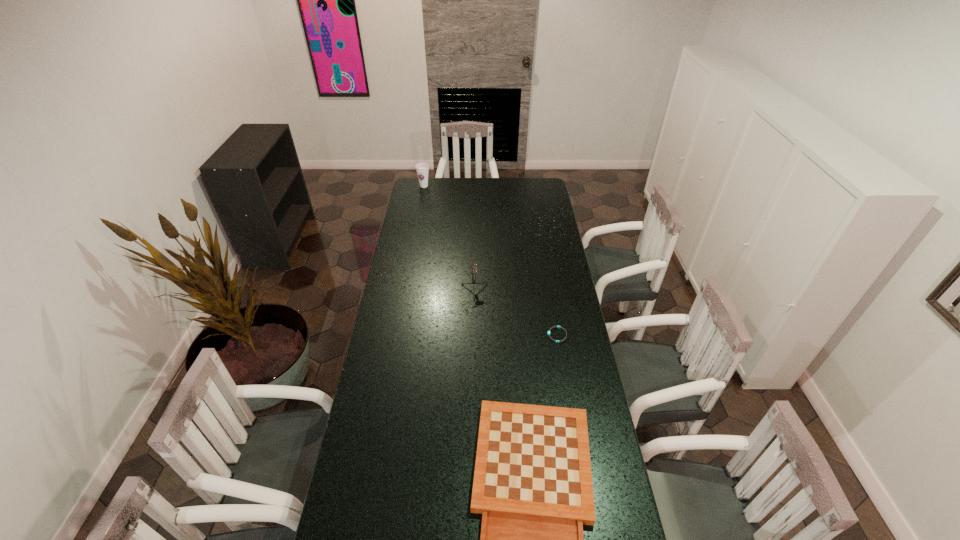
Locate an element on the screen. The image size is (960, 540). empty space between the second farthest object and the shortest object is located at coordinates (515, 317).

The width and height of the screenshot is (960, 540). In order to click on vacant area that lies between the second farthest object and the leftmost object in this screenshot , I will do `click(448, 242)`.

Image resolution: width=960 pixels, height=540 pixels. In order to click on free space between the farthest object and the third nearest object in this screenshot , I will do `click(448, 242)`.

Where is `free area in between the wristband and the leftmost object`? free area in between the wristband and the leftmost object is located at coordinates (491, 260).

Identify which object is the third nearest to the leftmost object. Please provide its 2D coordinates. Your answer should be formatted as a tuple, i.e. [(x, y)], where the tuple contains the x and y coordinates of a point satisfying the conditions above.

[(532, 484)]

Locate which object ranks in proximity to the leftmost object. Please provide its 2D coordinates. Your answer should be formatted as a tuple, i.e. [(x, y)], where the tuple contains the x and y coordinates of a point satisfying the conditions above.

[(474, 271)]